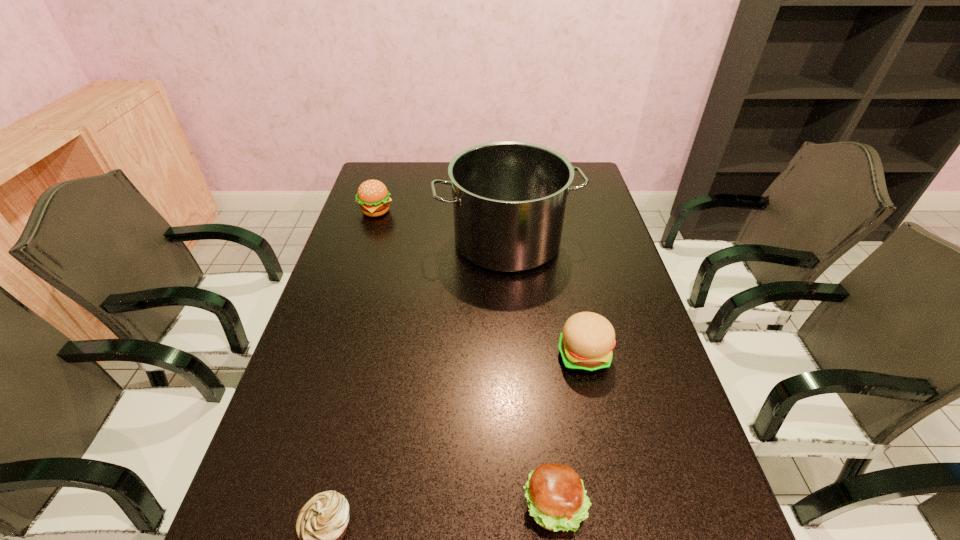
Locate an element on the screen. The height and width of the screenshot is (540, 960). vacant space at the right edge of the desktop is located at coordinates (597, 223).

Where is `free region at the far left corner of the desktop`? free region at the far left corner of the desktop is located at coordinates (387, 187).

Find the location of a particular element. This screenshot has height=540, width=960. unoccupied area between the leftmost hamburger and the second nearest hamburger is located at coordinates (480, 284).

You are a GUI agent. You are given a task and a screenshot of the screen. Output one action in this format:
    pyautogui.click(x=<x>, y=<y>)
    Task: Click on the unoccupied area between the tallest object and the third nearest object
    The image size is (960, 540).
    Given the screenshot: What is the action you would take?
    tap(545, 299)

Find the location of a particular element. The image size is (960, 540). unoccupied position between the third farthest object and the saucepan is located at coordinates (545, 299).

Image resolution: width=960 pixels, height=540 pixels. Identify the location of blank region between the tallest object and the farthest hamburger. (442, 226).

Identify the location of vacant area between the farthest hamburger and the third farthest object. (480, 284).

Locate which object is the fourth closest to the saucepan. Please provide its 2D coordinates. Your answer should be formatted as a tuple, i.e. [(x, y)], where the tuple contains the x and y coordinates of a point satisfying the conditions above.

[(322, 522)]

Locate an element on the screen. object that is the closest to the shortest object is located at coordinates (557, 501).

The height and width of the screenshot is (540, 960). I want to click on hamburger object that ranks as the closest to the third nearest object, so click(557, 501).